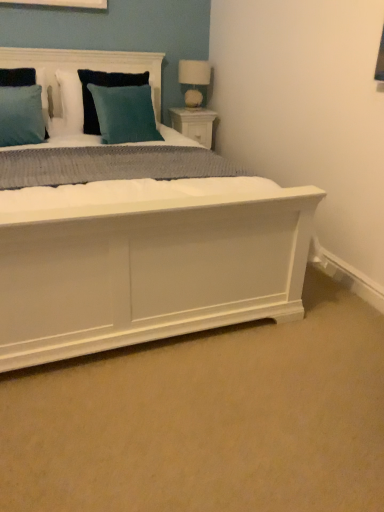
Describe the element at coordinates (18, 77) in the screenshot. I see `teal fabric pillow at upper left, which is the 3th pillow from back to front` at that location.

What is the approximate height of teal velvet pillow at upper center, which is counted as the 2th pillow, starting from the front?

It is 20.56 inches.

The height and width of the screenshot is (512, 384). What do you see at coordinates (194, 123) in the screenshot?
I see `white wood nightstand at upper right` at bounding box center [194, 123].

What is the approximate width of white fabric lampshade at upper right?

The width of white fabric lampshade at upper right is 10.48 inches.

Image resolution: width=384 pixels, height=512 pixels. I want to click on teal fabric pillow at upper left, positioned as the 1th pillow in front-to-back order, so click(x=18, y=77).

Is white fabric lampshade at upper right facing away from white wood nightstand at upper right?

No, white fabric lampshade at upper right is not facing the opposite direction of white wood nightstand at upper right.

Considering the positions of objects white fabric lampshade at upper right and white wood nightstand at upper right in the image provided, who is more to the right, white fabric lampshade at upper right or white wood nightstand at upper right?

white fabric lampshade at upper right is more to the right.

How different are the orientations of white fabric lampshade at upper right and white wood nightstand at upper right in degrees?

They differ by 0.00316 degrees in their facing directions.

From a real-world perspective, which object rests below the other?

In real-world perspective, white wood nightstand at upper right is lower.

Which of these two, teal velvet pillow at upper center, which appears as the second pillow when viewed from the back, or white fabric lampshade at upper right, stands taller?

teal velvet pillow at upper center, which appears as the second pillow when viewed from the back.

Consider the image. Who is bigger, teal velvet pillow at upper center, which is counted as the 2th pillow, starting from the front, or white fabric lampshade at upper right?

A: With larger size is teal velvet pillow at upper center, which is counted as the 2th pillow, starting from the front.

From the image's perspective, is teal velvet pillow at upper center, which is counted as the 2th pillow, starting from the front, under white fabric lampshade at upper right?

Yes, from the image's perspective, teal velvet pillow at upper center, which is counted as the 2th pillow, starting from the front, is below white fabric lampshade at upper right.

Can you tell me how much teal velvet pillow at upper center, which is counted as the 2th pillow, starting from the front, and white fabric lampshade at upper right differ in facing direction?

teal velvet pillow at upper center, which is counted as the 2th pillow, starting from the front, and white fabric lampshade at upper right are facing 1.78 degrees away from each other.

From a real-world perspective, is teal fabric pillow at upper left, positioned as the 1th pillow in front-to-back order, positioned above or below teal fabric pillow at upper center, arranged as the first pillow when viewed from the back?

From a real-world perspective, teal fabric pillow at upper left, positioned as the 1th pillow in front-to-back order, is physically below teal fabric pillow at upper center, arranged as the first pillow when viewed from the back.

Is teal fabric pillow at upper left, which is the 3th pillow from back to front, oriented towards teal fabric pillow at upper center, arranged as the first pillow when viewed from the back?

No, teal fabric pillow at upper left, which is the 3th pillow from back to front, is not oriented towards teal fabric pillow at upper center, arranged as the first pillow when viewed from the back.

Is teal fabric pillow at upper left, positioned as the 1th pillow in front-to-back order, surrounding teal fabric pillow at upper center, the third pillow positioned from the front?

No, teal fabric pillow at upper center, the third pillow positioned from the front, is not inside teal fabric pillow at upper left, positioned as the 1th pillow in front-to-back order.

Is teal fabric pillow at upper left, positioned as the 1th pillow in front-to-back order, far from teal fabric pillow at upper center, the third pillow positioned from the front?

Actually, teal fabric pillow at upper left, positioned as the 1th pillow in front-to-back order, and teal fabric pillow at upper center, the third pillow positioned from the front, are a little close together.

Which of these two, white fabric lampshade at upper right or teal fabric pillow at upper center, arranged as the first pillow when viewed from the back, is smaller?

white fabric lampshade at upper right is smaller.

Can teal fabric pillow at upper center, the third pillow positioned from the front, be found inside white fabric lampshade at upper right?

No, teal fabric pillow at upper center, the third pillow positioned from the front, is located outside of white fabric lampshade at upper right.

From a real-world perspective, is white fabric lampshade at upper right positioned under teal fabric pillow at upper center, arranged as the first pillow when viewed from the back, based on gravity?

No, from a real-world perspective, white fabric lampshade at upper right is not beneath teal fabric pillow at upper center, arranged as the first pillow when viewed from the back.

Measure the distance from teal fabric pillow at upper center, the third pillow positioned from the front, to teal fabric pillow at upper center.

teal fabric pillow at upper center, the third pillow positioned from the front, and teal fabric pillow at upper center are 8.39 inches apart from each other.

From a real-world perspective, is teal fabric pillow at upper center, arranged as the first pillow when viewed from the back, beneath teal fabric pillow at upper center?

Yes.

Is teal fabric pillow at upper center, arranged as the first pillow when viewed from the back, to the right of teal fabric pillow at upper center from the viewer's perspective?

Incorrect, teal fabric pillow at upper center, arranged as the first pillow when viewed from the back, is not on the right side of teal fabric pillow at upper center.

Is teal fabric pillow at upper center, the third pillow positioned from the front, not close to teal fabric pillow at upper center?

No.

Is teal velvet pillow at upper center, which is counted as the 2th pillow, starting from the front, next to white wood nightstand at upper right and touching it?

No, teal velvet pillow at upper center, which is counted as the 2th pillow, starting from the front, is not touching white wood nightstand at upper right.

Is teal velvet pillow at upper center, which is counted as the 2th pillow, starting from the front, positioned with its back to white wood nightstand at upper right?

No, teal velvet pillow at upper center, which is counted as the 2th pillow, starting from the front, is not facing the opposite direction of white wood nightstand at upper right.

Can you tell me how much teal velvet pillow at upper center, which appears as the second pillow when viewed from the back, and white wood nightstand at upper right differ in facing direction?

1.78 degrees.

Does teal velvet pillow at upper center, which appears as the second pillow when viewed from the back, contain white wood nightstand at upper right?

Definitely not — white wood nightstand at upper right is not inside teal velvet pillow at upper center, which appears as the second pillow when viewed from the back.

Who is taller, teal fabric pillow at upper center or white fabric lampshade at upper right?

teal fabric pillow at upper center is taller.

Is teal fabric pillow at upper center next to white fabric lampshade at upper right?

No, teal fabric pillow at upper center is not touching white fabric lampshade at upper right.

Measure the distance from teal fabric pillow at upper center to white fabric lampshade at upper right.

teal fabric pillow at upper center and white fabric lampshade at upper right are 21.39 inches apart from each other.

From the image's perspective, is teal fabric pillow at upper center located beneath white fabric lampshade at upper right?

Yes, from the image's perspective, teal fabric pillow at upper center is below white fabric lampshade at upper right.

Image resolution: width=384 pixels, height=512 pixels. I want to click on table lamp above the white wood nightstand at upper right (from the image's perspective), so click(x=194, y=80).

Which pillow is the 1st one when counting from the left side of the white fabric lampshade at upper right? Please provide its 2D coordinates.

[(125, 114)]

In the scene shown: From the image, which object appears to be nearer to white fabric lampshade at upper right, white wood nightstand at upper right or teal velvet pillow at upper center, which is counted as the 2th pillow, starting from the front?

white wood nightstand at upper right is closer to white fabric lampshade at upper right.

Looking at the image, which one is located closer to teal fabric pillow at upper left, which is the 3th pillow from back to front, teal velvet pillow at upper center, which appears as the second pillow when viewed from the back, or teal fabric pillow at upper center?

Based on the image, teal fabric pillow at upper center appears to be nearer to teal fabric pillow at upper left, which is the 3th pillow from back to front.

Estimate the real-world distances between objects in this image. Which object is closer to white fabric lampshade at upper right, teal fabric pillow at upper left, which is the 3th pillow from back to front, or white wood nightstand at upper right?

white wood nightstand at upper right is closer to white fabric lampshade at upper right.

Looking at the image, which one is located closer to teal fabric pillow at upper center, white wood nightstand at upper right or teal fabric pillow at upper center, the third pillow positioned from the front?

teal fabric pillow at upper center, the third pillow positioned from the front, lies closer to teal fabric pillow at upper center than the other object.

Which object lies further to the anchor point teal fabric pillow at upper center, the third pillow positioned from the front, teal velvet pillow at upper center, which appears as the second pillow when viewed from the back, or white fabric lampshade at upper right?

Based on the image, white fabric lampshade at upper right appears to be further to teal fabric pillow at upper center, the third pillow positioned from the front.

Estimate the real-world distances between objects in this image. Which object is further from teal velvet pillow at upper center, which appears as the second pillow when viewed from the back, teal fabric pillow at upper center, arranged as the first pillow when viewed from the back, or white wood nightstand at upper right?

The object further to teal velvet pillow at upper center, which appears as the second pillow when viewed from the back, is white wood nightstand at upper right.

Based on their spatial positions, is teal fabric pillow at upper center or white wood nightstand at upper right further from teal velvet pillow at upper center, which appears as the second pillow when viewed from the back?

white wood nightstand at upper right is positioned further to the anchor teal velvet pillow at upper center, which appears as the second pillow when viewed from the back.

Looking at the image, which one is located further to teal fabric pillow at upper center, teal fabric pillow at upper center, arranged as the first pillow when viewed from the back, or teal velvet pillow at upper center, which appears as the second pillow when viewed from the back?

Based on the image, teal velvet pillow at upper center, which appears as the second pillow when viewed from the back, appears to be further to teal fabric pillow at upper center.

Find the location of a particular element. The width and height of the screenshot is (384, 512). headboard between teal velvet pillow at upper center, which is counted as the 2th pillow, starting from the front, and white wood nightstand at upper right from front to back is located at coordinates pyautogui.click(x=86, y=66).

Where is `headboard between teal fabric pillow at upper left, positioned as the 1th pillow in front-to-back order, and white wood nightstand at upper right from front to back`? headboard between teal fabric pillow at upper left, positioned as the 1th pillow in front-to-back order, and white wood nightstand at upper right from front to back is located at coordinates (86, 66).

At what (x,y) coordinates should I click in order to perform the action: click on headboard situated between teal fabric pillow at upper center, arranged as the first pillow when viewed from the back, and white fabric lampshade at upper right from left to right. Please return your answer as a coordinate pair (x, y). This screenshot has height=512, width=384. Looking at the image, I should click on (86, 66).

Find the location of a particular element. This screenshot has width=384, height=512. headboard between teal fabric pillow at upper left, positioned as the 1th pillow in front-to-back order, and teal fabric pillow at upper center, arranged as the first pillow when viewed from the back, along the z-axis is located at coordinates (86, 66).